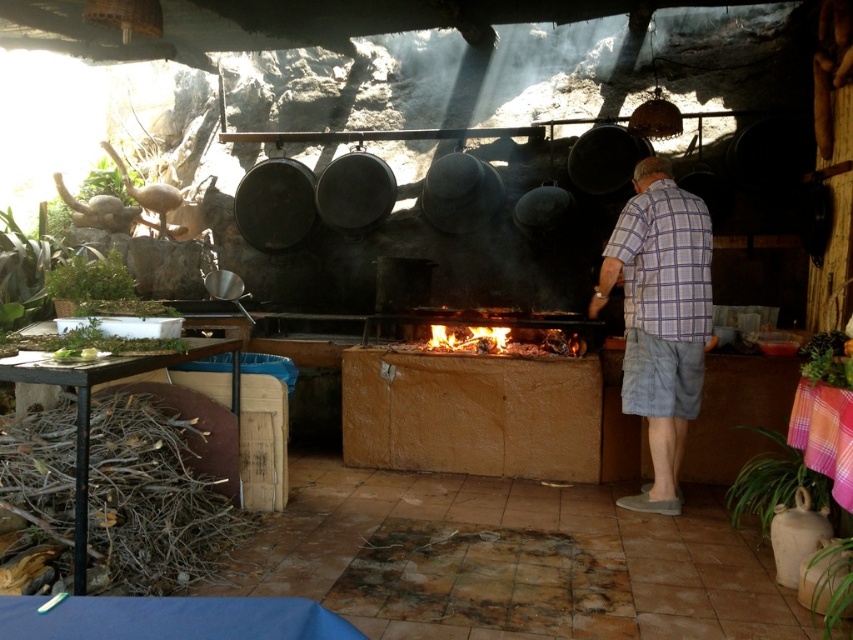
You are standing in the outdoor cooking area and notice the plaid shirt at center and the burning wood at center. According to the scene description, which object is positioned to the right of the other?

The plaid shirt at center is to the right of burning wood at center.

You are a photographer trying to capture the scene of the outdoor cooking area. You want to ensure that both the plaid shirt at center and the burning wood at center are clearly visible in your photo. Which object should you focus on first to ensure proper depth of field?

The burning wood at center is thicker than the plaid shirt at center, so focusing on the burning wood at center first would help ensure both objects are in focus due to its greater thickness contributing to a deeper depth of field.